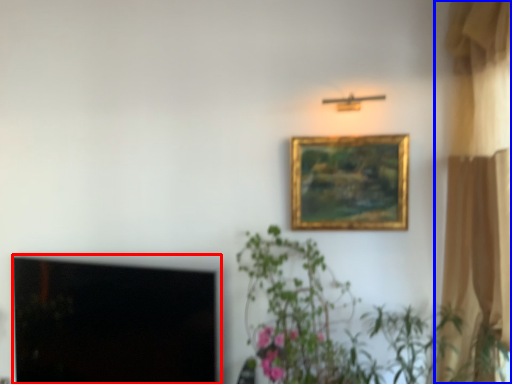
Question: Among these objects, which one is nearest to the camera, window screen (highlighted by a red box) or curtain (highlighted by a blue box)?

Choices:
 (A) window screen
 (B) curtain

Answer: (B)